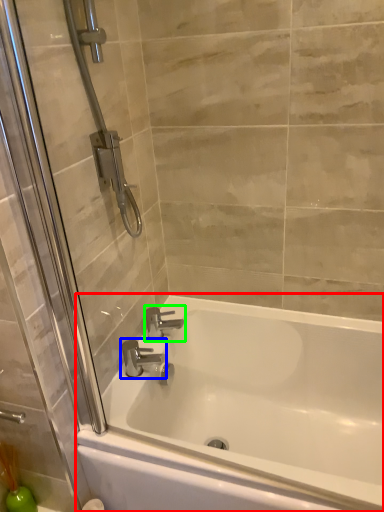
Question: Estimate the real-world distances between objects in this image. Which object is farther from bathtub (highlighted by a red box), tap (highlighted by a blue box) or tap (highlighted by a green box)?

Choices:
 (A) tap
 (B) tap

Answer: (B)